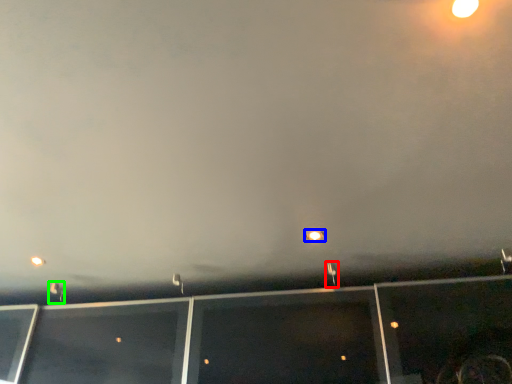
Question: Based on their relative distances, which object is nearer to street light (highlighted by a red box)? Choose from street light (highlighted by a blue box) and street light (highlighted by a green box).

Choices:
 (A) street light
 (B) street light

Answer: (A)